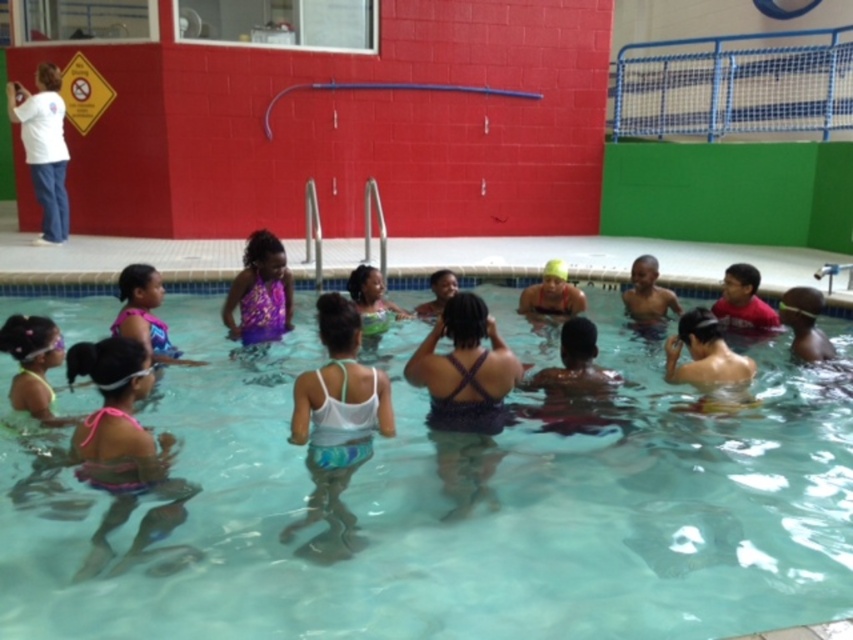
Question: Which is farther from the white matte swimsuit at center?

Choices:
 (A) white smooth shirt at upper left
 (B) clear plastic water at center
 (C) pink fabric swimsuit at lower left
 (D) purple printed swimsuit at center

Answer: (A)

Question: Does white matte swimsuit at center have a larger size compared to pink fabric swimsuit at lower left?

Choices:
 (A) yes
 (B) no

Answer: (A)

Question: Can you confirm if clear plastic water at center is thinner than purple printed swimsuit at center?

Choices:
 (A) yes
 (B) no

Answer: (B)

Question: Is white matte swimsuit at center to the left of white smooth shirt at upper left from the viewer's perspective?

Choices:
 (A) yes
 (B) no

Answer: (B)

Question: Which of these objects is positioned closest to the pink fabric swimsuit at lower left?

Choices:
 (A) white matte swimsuit at center
 (B) white smooth shirt at upper left

Answer: (A)

Question: Which point is closer to the camera?

Choices:
 (A) purple printed swimsuit at center
 (B) clear plastic water at center
 (C) pink fabric swimsuit at lower left
 (D) white smooth shirt at upper left

Answer: (B)